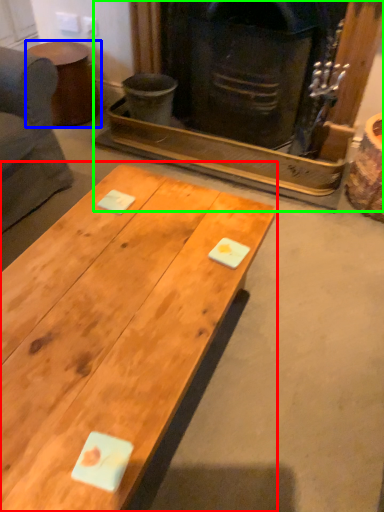
Question: Based on their relative distances, which object is farther from coffee table (highlighted by a red box)? Choose from side table (highlighted by a blue box) and fireplace (highlighted by a green box).

Choices:
 (A) side table
 (B) fireplace

Answer: (A)